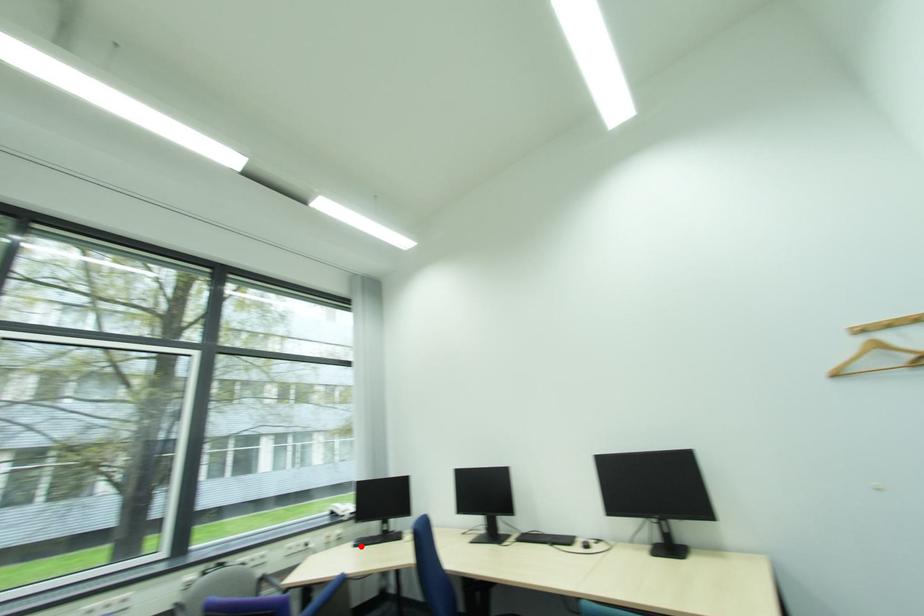
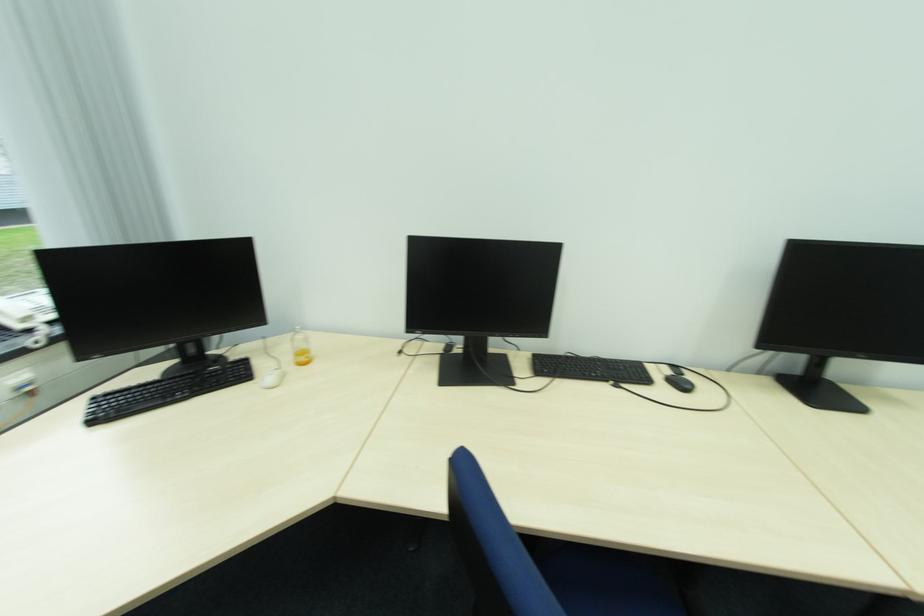
Question: I am providing you with two images of the same scene from different viewpoints. Given a red point in image1, look at the same physical point in image2. Is it:

Choices:
 (A) Closer to the viewpoint
 (B) Farther from the viewpoint

Answer: (A)